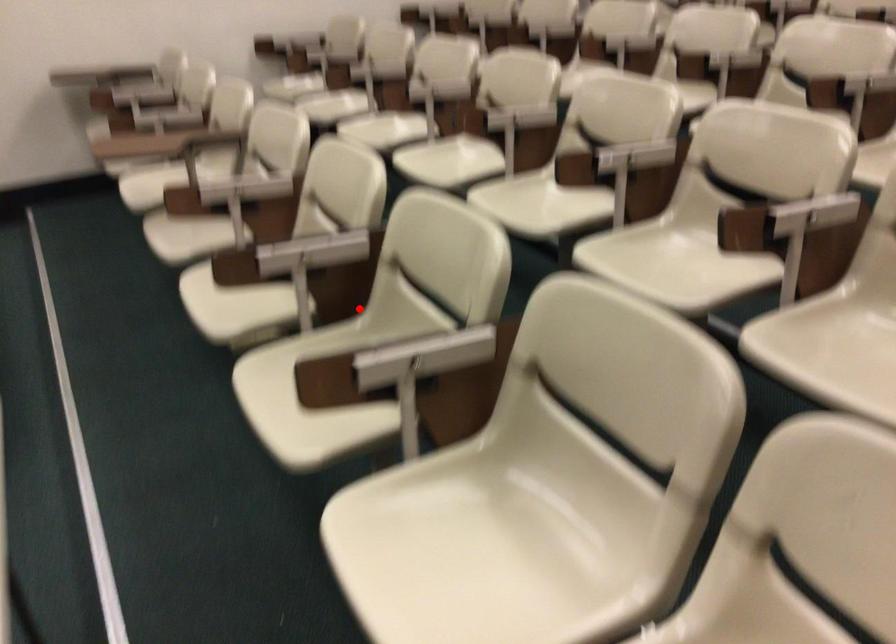
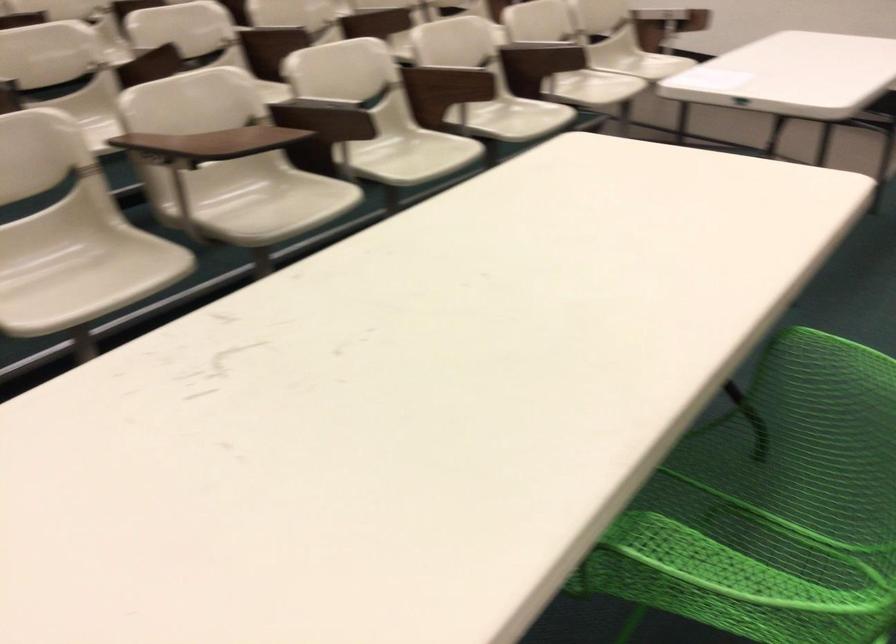
Where in the second image is the point corresponding to the highlighted location from the first image?

(405, 147)